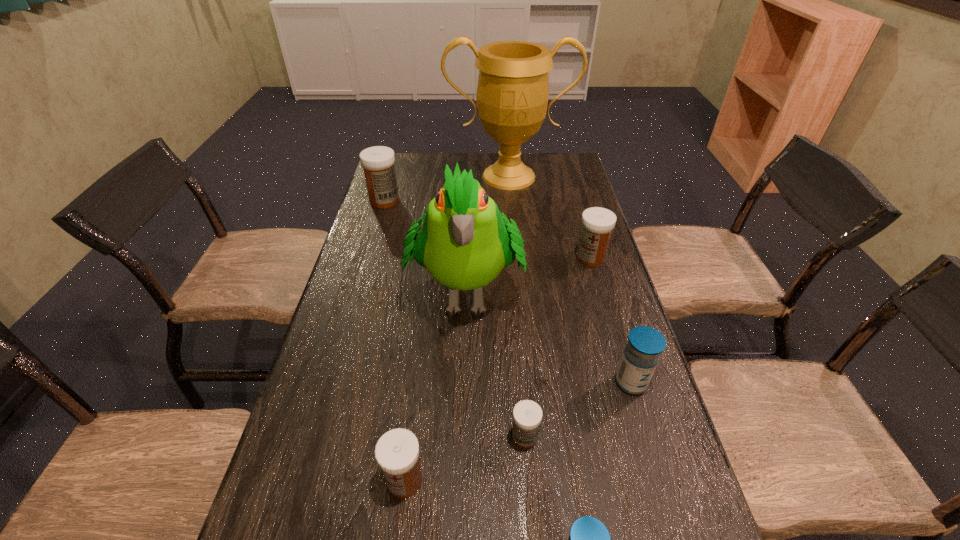
You are a GUI agent. You are given a task and a screenshot of the screen. Output one action in this format:
    pyautogui.click(x=<x>, y=<y>)
    Task: Click on the object situated at the left edge
    The image size is (960, 540).
    Given the screenshot: What is the action you would take?
    pyautogui.click(x=378, y=162)

The width and height of the screenshot is (960, 540). Find the location of `trophy that is at the right edge`. trophy that is at the right edge is located at coordinates (512, 95).

In order to click on object at the far right corner in this screenshot , I will do `click(512, 95)`.

The width and height of the screenshot is (960, 540). In the image, there is a desktop. What are the coordinates of `vacant space at the far edge` in the screenshot? It's located at (430, 180).

You are a GUI agent. You are given a task and a screenshot of the screen. Output one action in this format:
    pyautogui.click(x=<x>, y=<y>)
    Task: Click on the free region at the left edge of the desktop
    The image size is (960, 540).
    Given the screenshot: What is the action you would take?
    pyautogui.click(x=400, y=279)

At what (x,y) coordinates should I click in order to perform the action: click on blank area at the right edge. Please return your answer as a coordinate pair (x, y). The height and width of the screenshot is (540, 960). Looking at the image, I should click on (590, 378).

Locate an element on the screen. vacant space at the far left corner of the desktop is located at coordinates (404, 162).

At what (x,y) coordinates should I click in order to perform the action: click on vacant space at the far right corner. Please return your answer as a coordinate pair (x, y). Looking at the image, I should click on (553, 169).

At what (x,y) coordinates should I click in order to perform the action: click on vacant area that lies between the parakeet and the second nearest medicine. Please return your answer as a coordinate pair (x, y). Looking at the image, I should click on (435, 385).

Where is `vacant area that lies between the second farthest medicine and the second nearest medicine`? The image size is (960, 540). vacant area that lies between the second farthest medicine and the second nearest medicine is located at coordinates (497, 369).